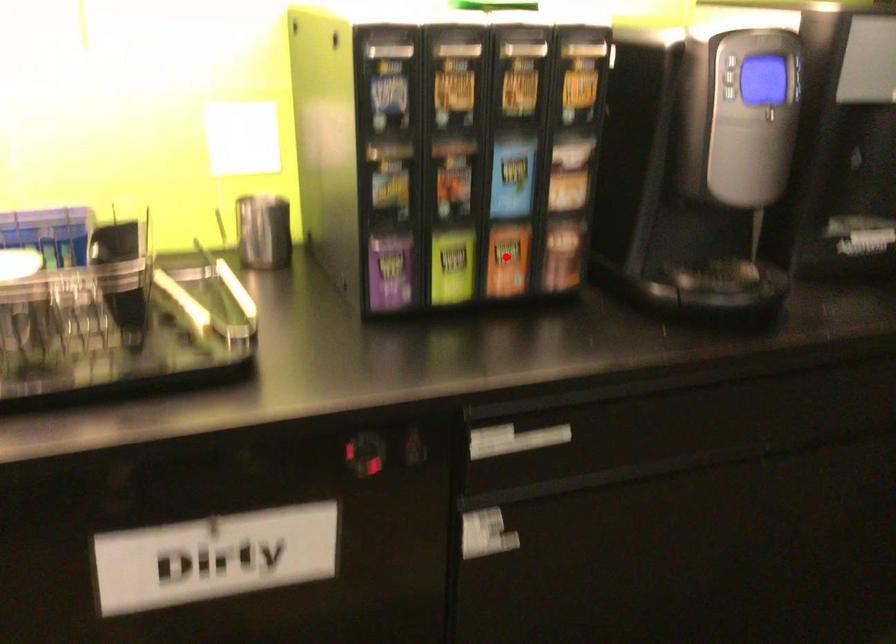
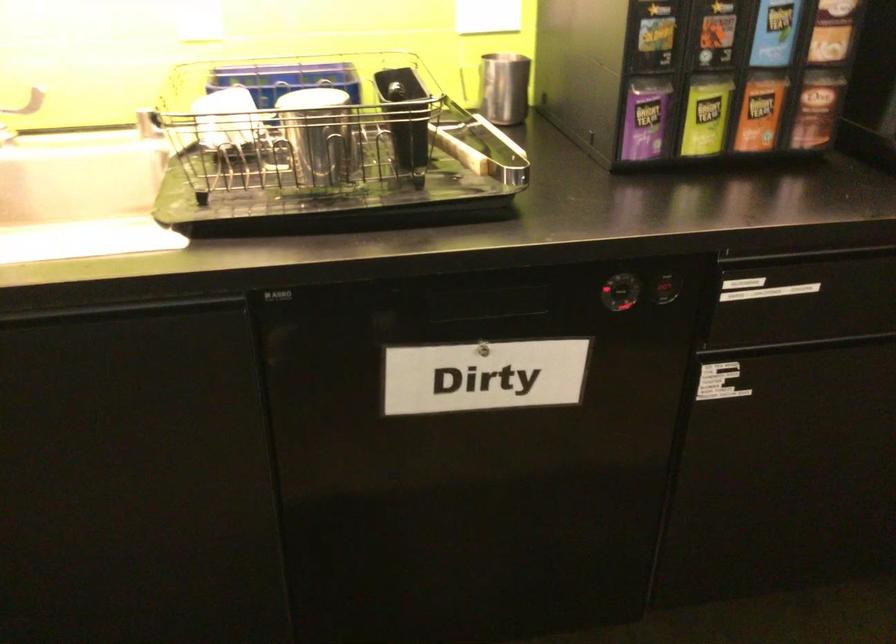
In the second image, find the point that corresponds to the highlighted location in the first image.

(760, 111)